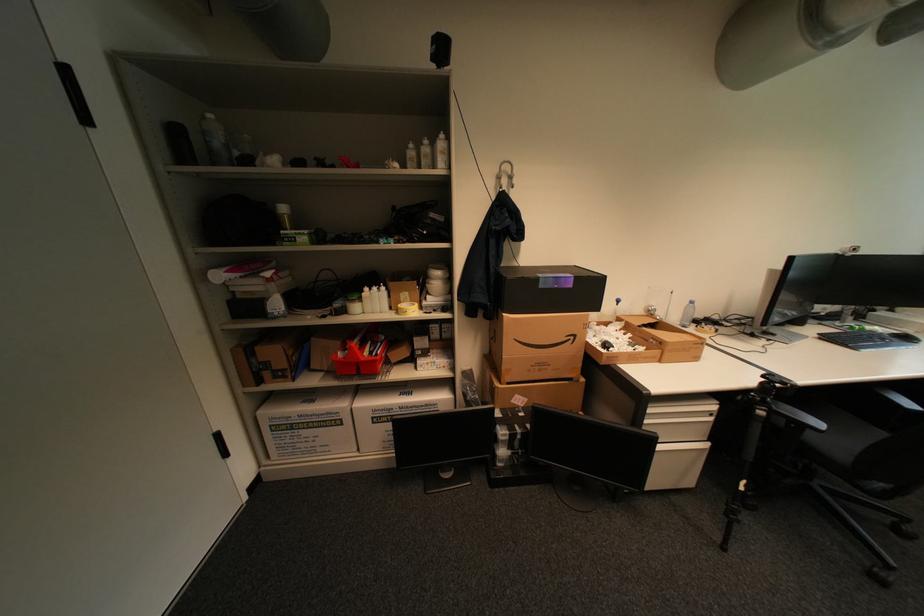
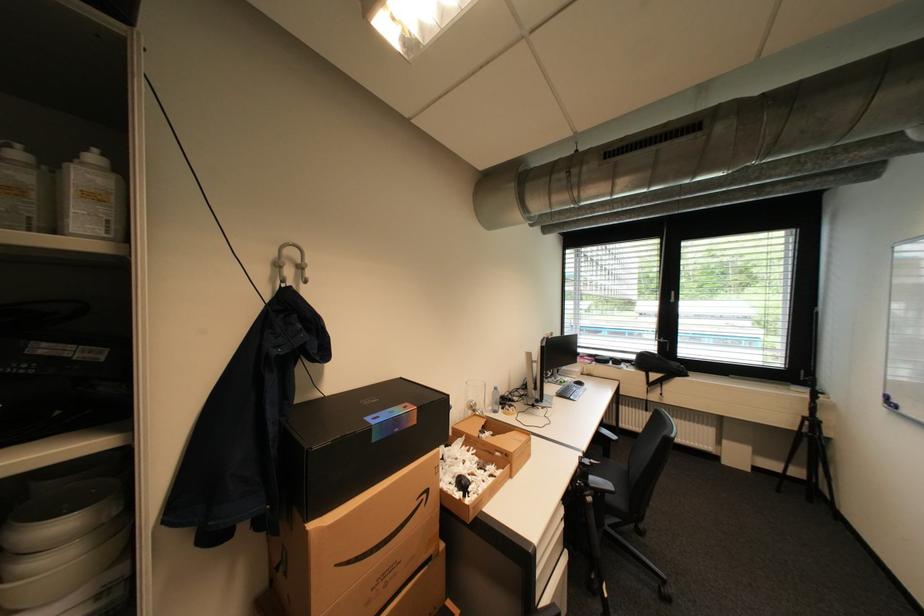
Question: Based on the continuous images, in which direction is the camera rotating? Reply with the corresponding letter.

Choices:
 (A) Left
 (B) Right
 (C) Up
 (D) Down

Answer: (B)